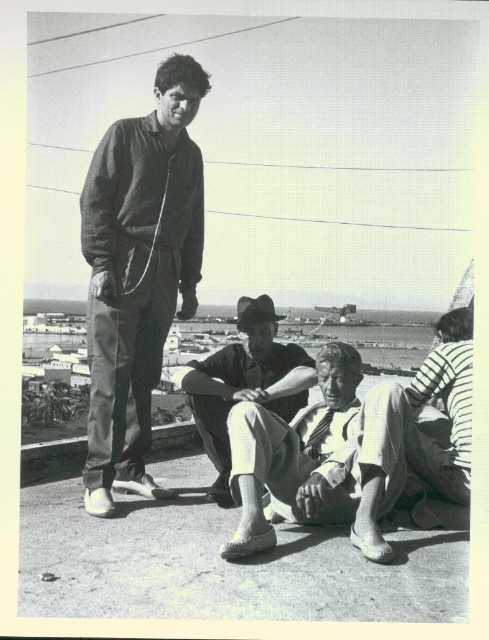
Question: Does matte black jacket at upper left appear over striped cotton shirt at lower right?

Choices:
 (A) no
 (B) yes

Answer: (B)

Question: Is matte black jacket at upper left positioned in front of matte black hat at center?

Choices:
 (A) no
 (B) yes

Answer: (B)

Question: Among these objects, which one is nearest to the camera?

Choices:
 (A) matte black jacket at upper left
 (B) light beige cotton shirt at center

Answer: (B)

Question: Estimate the real-world distances between objects in this image. Which object is closer to the matte black jacket at upper left?

Choices:
 (A) striped cotton shirt at lower right
 (B) light beige cotton shirt at center

Answer: (B)

Question: From the image, what is the correct spatial relationship of matte black jacket at upper left in relation to light beige cotton shirt at center?

Choices:
 (A) left
 (B) right

Answer: (A)

Question: Which object appears closest to the camera in this image?

Choices:
 (A) matte black jacket at upper left
 (B) matte black hat at center
 (C) striped cotton shirt at lower right

Answer: (C)